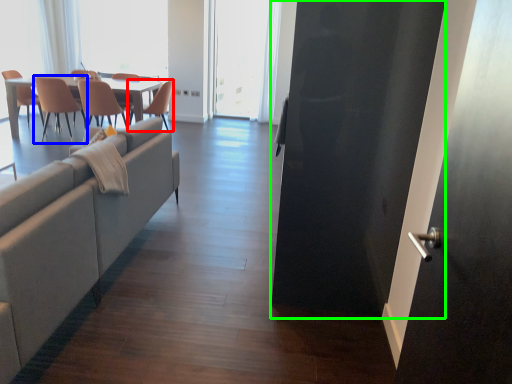
Question: Considering the real-world distances, which object is farthest from chair (highlighted by a red box)? chair (highlighted by a blue box) or screen door (highlighted by a green box)?

Choices:
 (A) chair
 (B) screen door

Answer: (B)